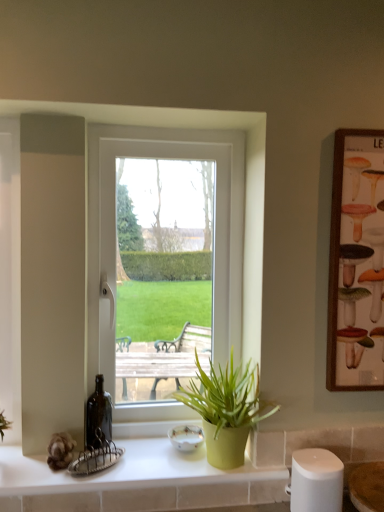
Question: Can you confirm if white plastic window at center is bigger than green matte pot at lower center?

Choices:
 (A) no
 (B) yes

Answer: (B)

Question: Are white plastic window at center and green matte pot at lower center located far from each other?

Choices:
 (A) yes
 (B) no

Answer: (B)

Question: Can you confirm if white plastic window at center is positioned to the right of green matte pot at lower center?

Choices:
 (A) yes
 (B) no

Answer: (B)

Question: Can you confirm if white plastic window at center is taller than green matte pot at lower center?

Choices:
 (A) no
 (B) yes

Answer: (B)

Question: Is white plastic window at center positioned in front of green matte pot at lower center?

Choices:
 (A) no
 (B) yes

Answer: (A)

Question: Considering their positions, is white glossy countertop at lower center located in front of or behind white plastic window at center?

Choices:
 (A) behind
 (B) front

Answer: (B)

Question: In terms of width, does white glossy countertop at lower center look wider or thinner when compared to white plastic window at center?

Choices:
 (A) wide
 (B) thin

Answer: (A)

Question: Based on their sizes in the image, would you say white glossy countertop at lower center is bigger or smaller than white plastic window at center?

Choices:
 (A) small
 (B) big

Answer: (A)

Question: From a real-world perspective, is white glossy countertop at lower center physically located above or below white plastic window at center?

Choices:
 (A) above
 (B) below

Answer: (B)

Question: From a real-world perspective, is green matte pot at lower center above or below white glossy countertop at lower center?

Choices:
 (A) below
 (B) above

Answer: (B)

Question: Considering the positions of green matte pot at lower center and white glossy countertop at lower center in the image, is green matte pot at lower center bigger or smaller than white glossy countertop at lower center?

Choices:
 (A) big
 (B) small

Answer: (A)

Question: From their relative heights in the image, would you say green matte pot at lower center is taller or shorter than white glossy countertop at lower center?

Choices:
 (A) tall
 (B) short

Answer: (A)

Question: In the image, is green matte pot at lower center positioned in front of or behind white glossy countertop at lower center?

Choices:
 (A) behind
 (B) front

Answer: (A)

Question: Based on their sizes in the image, would you say white glossy countertop at lower center is bigger or smaller than wooden framed poster at right?

Choices:
 (A) big
 (B) small

Answer: (A)

Question: From a real-world perspective, relative to wooden framed poster at right, is white glossy countertop at lower center vertically above or below?

Choices:
 (A) below
 (B) above

Answer: (A)